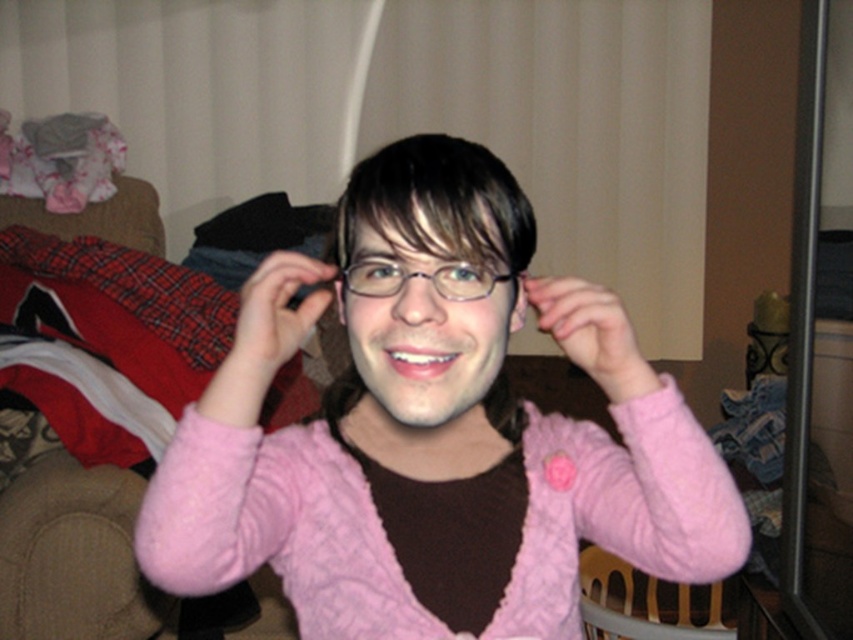
Question: Which point appears farthest from the camera in this image?

Choices:
 (A) (282, 346)
 (B) (577, 296)
 (C) (421, 552)

Answer: (C)

Question: Does pink fuzzy sweater at center appear on the left side of matte pink sweater at center?

Choices:
 (A) yes
 (B) no

Answer: (B)

Question: Which of these objects is positioned closest to the matte pink sweater at center?

Choices:
 (A) pink fuzzy hand at center
 (B) pink fuzzy sweater at center

Answer: (B)

Question: Does pink fuzzy sweater at center have a smaller size compared to wooden armchair at lower right?

Choices:
 (A) no
 (B) yes

Answer: (B)

Question: Is pink fuzzy hand at center smaller than matte pink sweater at center?

Choices:
 (A) no
 (B) yes

Answer: (B)

Question: Among these points, which one is nearest to the camera?

Choices:
 (A) pyautogui.click(x=514, y=301)
 (B) pyautogui.click(x=602, y=304)
 (C) pyautogui.click(x=268, y=340)

Answer: (C)